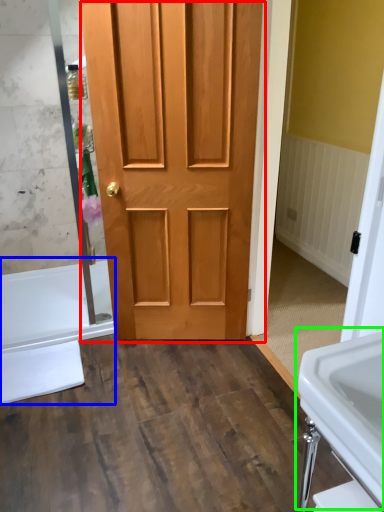
Question: Based on their relative distances, which object is nearer to door (highlighted by a red box)? Choose from bath (highlighted by a blue box) and sink (highlighted by a green box).

Choices:
 (A) bath
 (B) sink

Answer: (A)